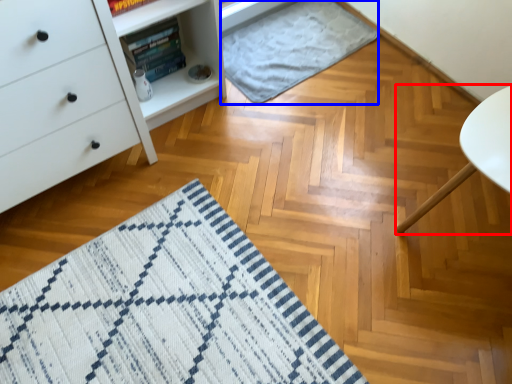
Question: Which of the following is the farthest to the observer, furniture (highlighted by a red box) or blanket (highlighted by a blue box)?

Choices:
 (A) furniture
 (B) blanket

Answer: (B)